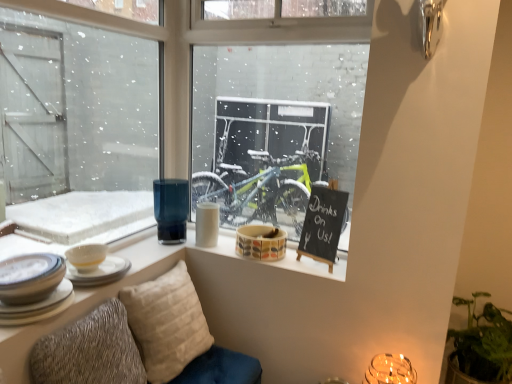
Question: From the image's perspective, is textured beige pillow at lower left, the first pillow in the front-to-back sequence, positioned above or below multicolored ceramic mug at center, the 7th tableware in the left-to-right sequence?

Choices:
 (A) above
 (B) below

Answer: (B)

Question: From a real-world perspective, is textured beige pillow at lower left, the first pillow in the front-to-back sequence, positioned above or below multicolored ceramic mug at center, the 1th tableware from the right?

Choices:
 (A) above
 (B) below

Answer: (B)

Question: Which is farther from the multicolored ceramic mug at center, the 1th tableware from the right?

Choices:
 (A) beige textured pillow at lower center, the second pillow when ordered from front to back
 (B) black chalkboard at upper right
 (C) porcelain bowl at center
 (D) white ceramic bowl at left, the first tableware from the left
 (E) white ceramic plates at lower left, the 2th tableware from the left

Answer: (E)

Question: Which object is the closest to the green leafy plant at lower right?

Choices:
 (A) multicolored ceramic mug at center, the 1th tableware from the right
 (B) translucent glass candle holder at lower right
 (C) beige textured pillow at lower center, which ranks as the 1th pillow in back-to-front order
 (D) porcelain bowl at center
 (E) white ceramic bowl at left, acting as the third tableware starting from the left

Answer: (B)